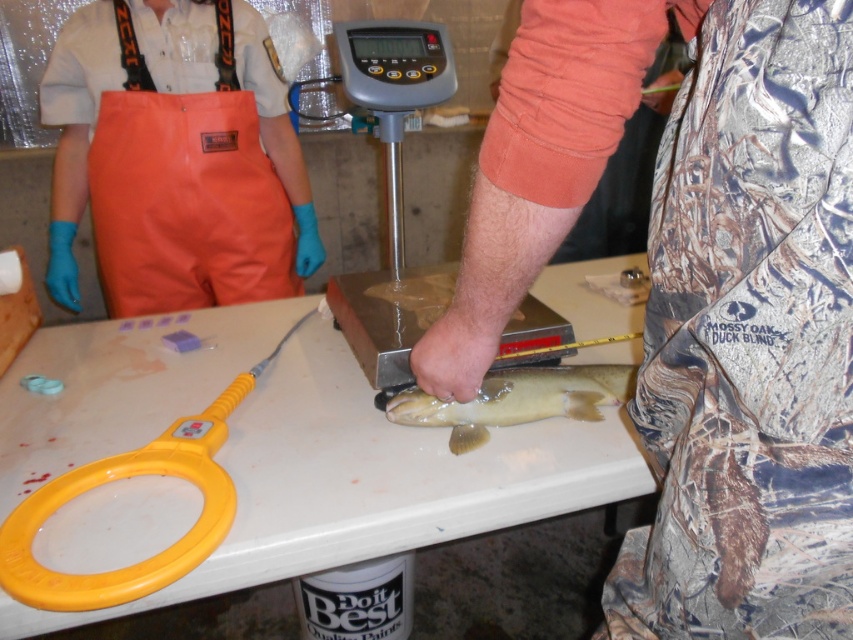
Who is higher up, camouflage fabric pants at lower right or white plastic table at center?

white plastic table at center is higher up.

Which of these two, camouflage fabric pants at lower right or white plastic table at center, stands shorter?

white plastic table at center is shorter.

Is point (836, 428) in front of point (79, 451)?

Yes, point (836, 428) is in front of point (79, 451).

Where is `camouflage fabric pants at lower right`? This screenshot has width=853, height=640. camouflage fabric pants at lower right is located at coordinates (698, 294).

Does camouflage fabric pants at lower right appear on the left side of yellow plastic scissors at lower left?

Incorrect, camouflage fabric pants at lower right is not on the left side of yellow plastic scissors at lower left.

Does point (730, 444) come closer to viewer compared to point (144, 572)?

Yes, point (730, 444) is in front of point (144, 572).

Locate an element on the screen. camouflage fabric pants at lower right is located at coordinates (698, 294).

Identify the location of camouflage fabric pants at lower right. 698,294.

Image resolution: width=853 pixels, height=640 pixels. What are the coordinates of `orange rubber pants at center` in the screenshot? It's located at (173, 163).

Does orange rubber pants at center appear under yellow plastic scissors at lower left?

No.

The image size is (853, 640). I want to click on orange rubber pants at center, so click(173, 163).